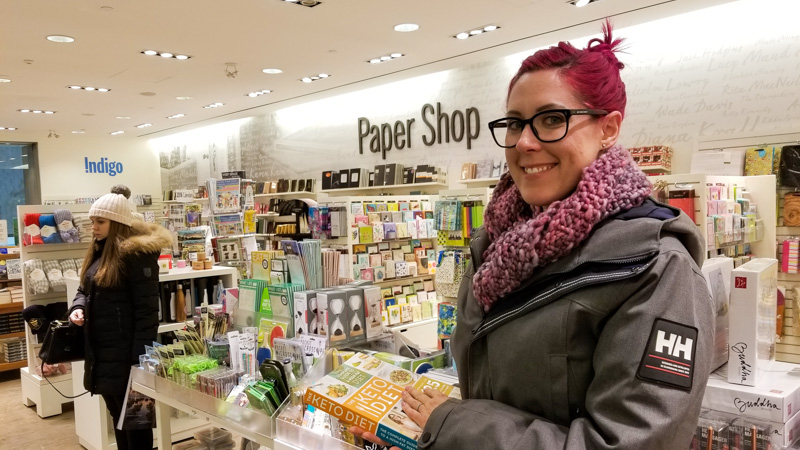
Locate an element on the screen. This screenshot has height=450, width=800. window is located at coordinates (16, 185).